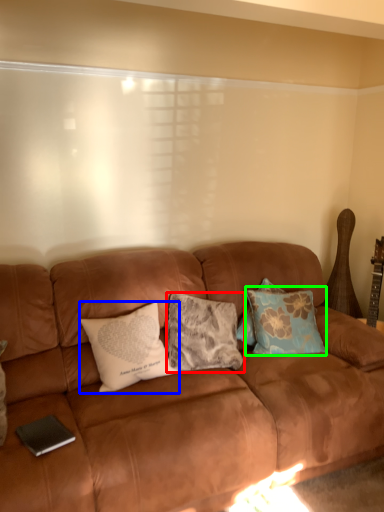
Question: Estimate the real-world distances between objects in this image. Which object is farther from pillow (highlighted by a red box), pillow (highlighted by a blue box) or pillow (highlighted by a green box)?

Choices:
 (A) pillow
 (B) pillow

Answer: (B)